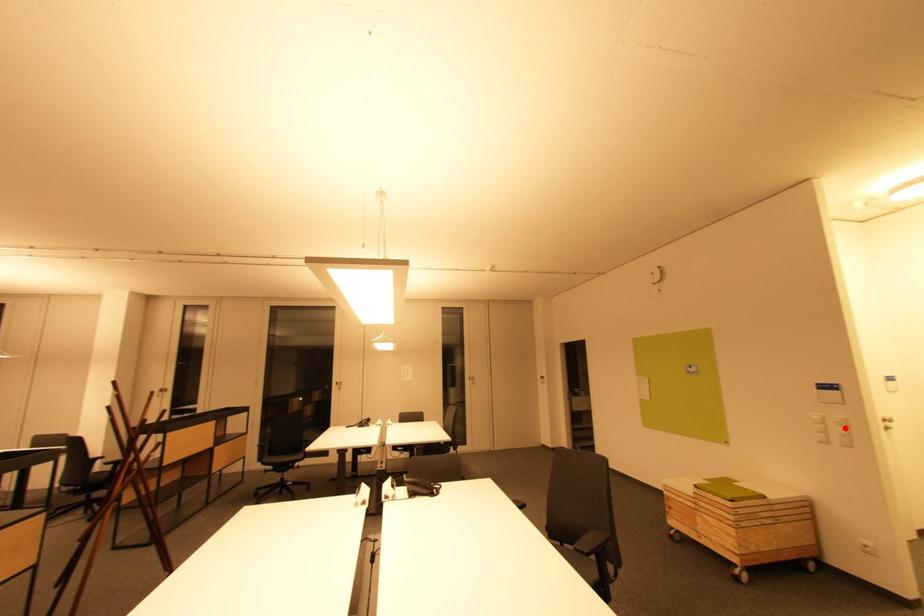
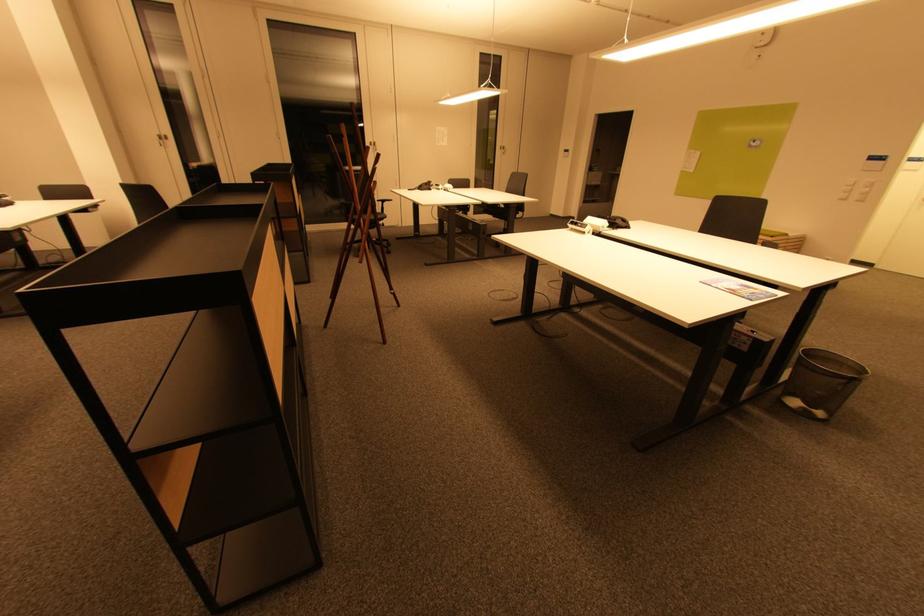
Locate, in the second image, the point that corresponds to the highlighted location in the first image.

(870, 188)